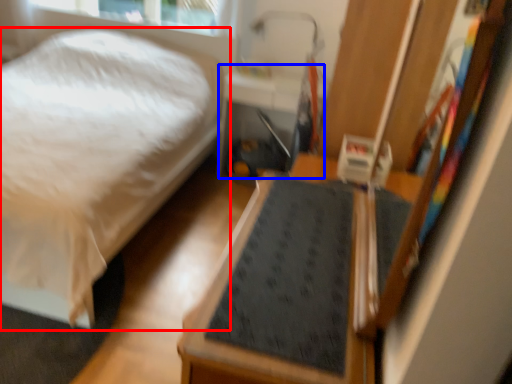
Question: Among these objects, which one is farthest to the camera, bed (highlighted by a red box) or table (highlighted by a blue box)?

Choices:
 (A) bed
 (B) table

Answer: (B)